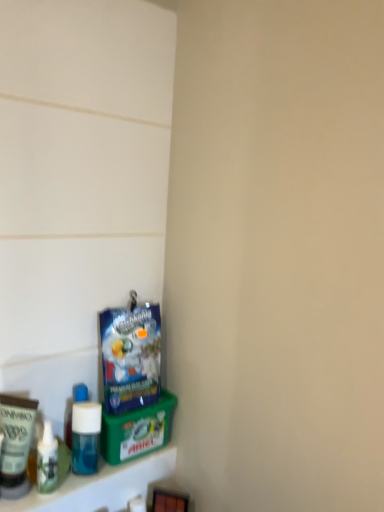
Question: Looking at their shapes, would you say blue matte bottle at lower left is wider or thinner than matte cream tube at lower left, the first toiletry viewed from the left?

Choices:
 (A) wide
 (B) thin

Answer: (A)

Question: Is blue matte bottle at lower left taller or shorter than matte cream tube at lower left, the first toiletry viewed from the left?

Choices:
 (A) short
 (B) tall

Answer: (A)

Question: Which object is the farthest from the blue plastic bag at lower left?

Choices:
 (A) matte cream tube at lower left, the 2th toiletry positioned from the right
 (B) translucent plastic soap dispenser at lower left, which is the second toiletry from left to right
 (C) blue matte bottle at lower left

Answer: (A)

Question: Which is farther from the translucent plastic soap dispenser at lower left, which is the first toiletry from right to left?

Choices:
 (A) blue plastic bag at lower left
 (B) matte cream tube at lower left, the first toiletry viewed from the left
 (C) blue matte bottle at lower left

Answer: (A)